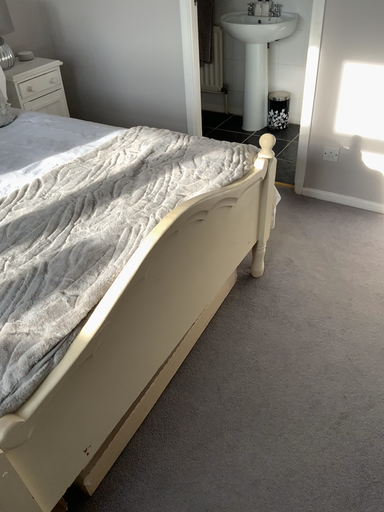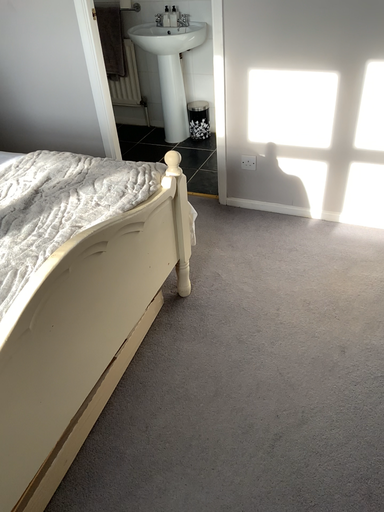
Question: How did the camera likely rotate when shooting the video?

Choices:
 (A) rotated right
 (B) rotated left

Answer: (A)